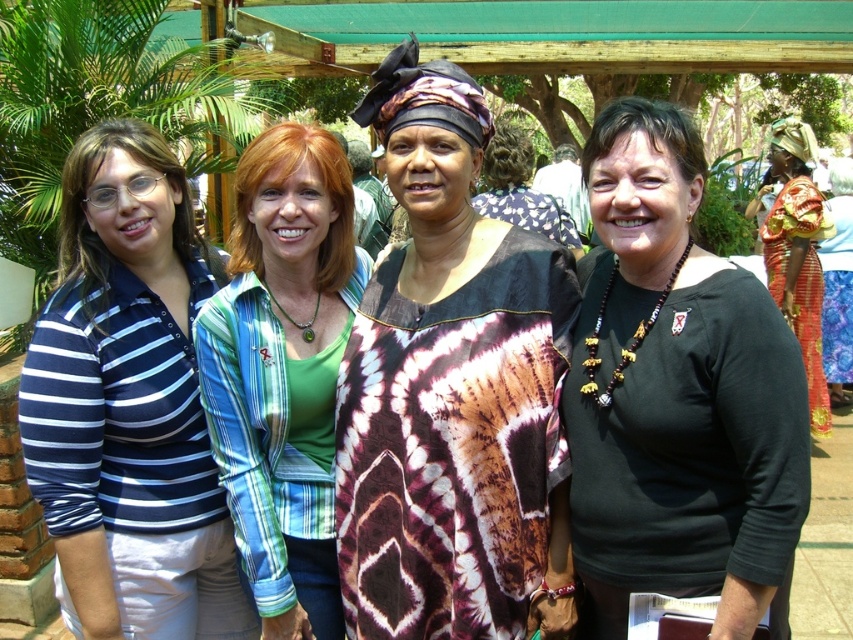
You are a photographer taking a picture of the group. You notice the black matte shirt at center and the shiny red fabric at right. Which one is positioned lower in the image?

The black matte shirt at center is positioned lower in the image as it is below the shiny red fabric at right.

You are standing at the edge of the scene and want to greet both the person wearing the green plaid shirt at center and the person in the patterned fabric dress at center. If you walk straight towards them, which one will you reach first?

The green plaid shirt at center is 7.28 feet away from the patterned fabric dress at center. Since you are walking straight towards them, you will reach the green plaid shirt at center first because it is closer to you than the patterned fabric dress at center.

From the picture: You are a photographer trying to capture a photo of the group. You notice the green plaid shirt at center and the shiny red fabric at right. Which clothing item is closer to the camera?

The green plaid shirt at center is shorter than shiny red fabric at right, so the green plaid shirt at center is closer to the camera.